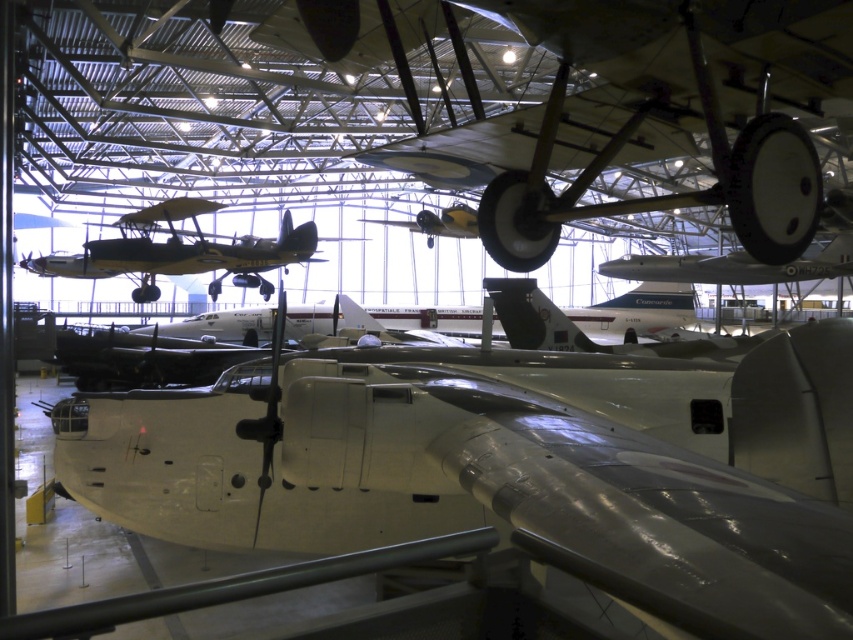
Is metallic silver airplane at center positioned behind yellow matte airplane at center?

No, it is not.

Does point (68, 449) lie behind point (434, 218)?

No, it is not.

Locate an element on the screen. metallic silver airplane at center is located at coordinates (511, 467).

In the scene shown: Does metallic silver airplane at center appear under shiny silver airplane at center?

Indeed, metallic silver airplane at center is positioned under shiny silver airplane at center.

Between metallic silver airplane at center and shiny silver airplane at center, which one appears on the right side from the viewer's perspective?

Positioned to the right is metallic silver airplane at center.

This screenshot has height=640, width=853. What do you see at coordinates (511, 467) in the screenshot?
I see `metallic silver airplane at center` at bounding box center [511, 467].

Find the location of a particular element. metallic silver airplane at center is located at coordinates (511, 467).

Between shiny silver airplane at center and yellow matte airplane at center, which one appears on the left side from the viewer's perspective?

shiny silver airplane at center is more to the left.

Between point (296, 234) and point (474, 225), which one is positioned in front?

Point (296, 234) is in front.

Who is more distant from viewer, (125, 216) or (424, 228)?

Positioned behind is point (424, 228).

Image resolution: width=853 pixels, height=640 pixels. Identify the location of shiny silver airplane at center. (183, 252).